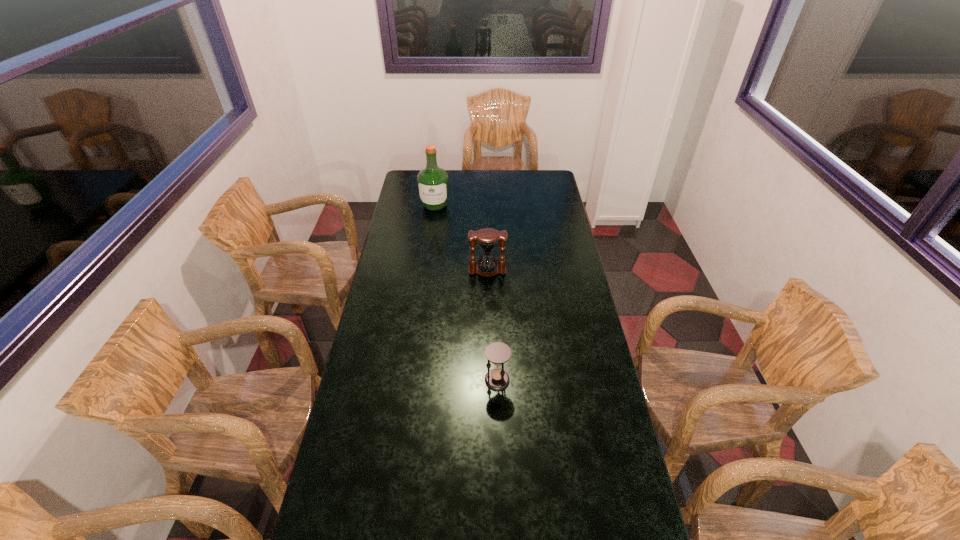
At what (x,y) coordinates should I click in order to perform the action: click on object that is the second closest to the farthest object. Please return your answer as a coordinate pair (x, y). Image resolution: width=960 pixels, height=540 pixels. Looking at the image, I should click on (498, 353).

Find the location of a particular element. Image resolution: width=960 pixels, height=540 pixels. object identified as the closest to the farther hourglass is located at coordinates [x=433, y=182].

Locate an element on the screen. vacant position in the image that satisfies the following two spatial constraints: 1. on the front-facing side of the second shortest object; 2. on the right side of the tallest object is located at coordinates tap(426, 271).

Identify the location of free location that satisfies the following two spatial constraints: 1. on the front-facing side of the farthest object; 2. on the left side of the nearest object. This screenshot has width=960, height=540. 411,380.